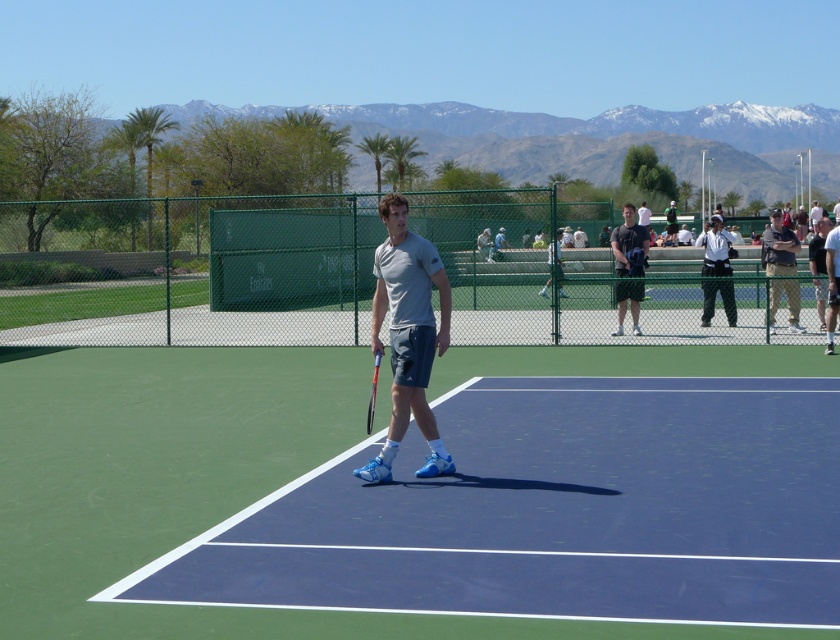
You are standing on the tennis court and want to reach a ball that landed at point [799,305]. If your maximum throwing distance is 20 meters, can you throw the ball back to the baseline without it going out of bounds?

The distance of point [799,305] from viewer is 18.30 meters, so yes, you can throw the ball back to the baseline since the distance is within your maximum throwing range of 20 meters.

You are standing at the edge of the tennis court and see the gray matte tennis racket at center. If you want to retrieve it without moving closer than 8 meters, can you reach it?

The gray matte tennis racket at center is 8.62 meters away from viewer. Since you cannot move closer than 8 meters, you cannot reach it as it is beyond that distance.